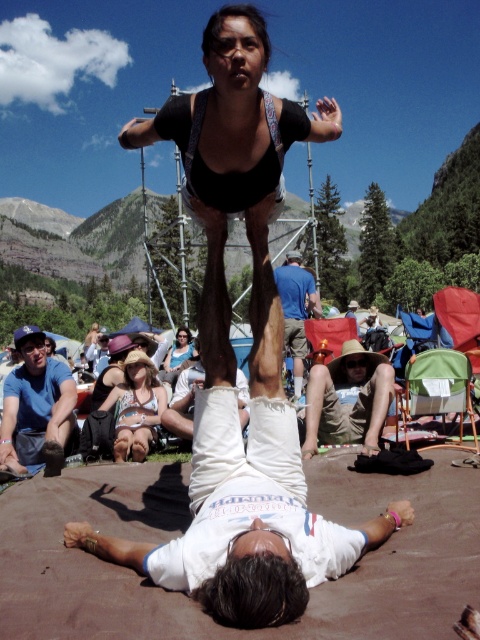
Question: Which of the following is the farthest from the observer?

Choices:
 (A) blue t-shirt at lower left
 (B) blue cotton shirt at center
 (C) tan straw hat at center
 (D) white cotton pants at center

Answer: (C)

Question: Can you confirm if white cotton pants at center is wider than white cotton tank top at center?

Choices:
 (A) no
 (B) yes

Answer: (B)

Question: Can you confirm if blue t-shirt at lower left is wider than tan straw hat at center?

Choices:
 (A) no
 (B) yes

Answer: (A)

Question: Which of the following is the farthest from the observer?

Choices:
 (A) white cotton pants at center
 (B) blue t-shirt at lower left
 (C) white cotton tank top at center

Answer: (C)

Question: Estimate the real-world distances between objects in this image. Which object is closer to the blue cotton shirt at center?

Choices:
 (A) light blue denim shorts at center
 (B) blue t-shirt at lower left
 (C) white cotton pants at center

Answer: (A)

Question: Can you confirm if tan straw hat at center is positioned to the left of blue cotton shirt at center?

Choices:
 (A) yes
 (B) no

Answer: (B)